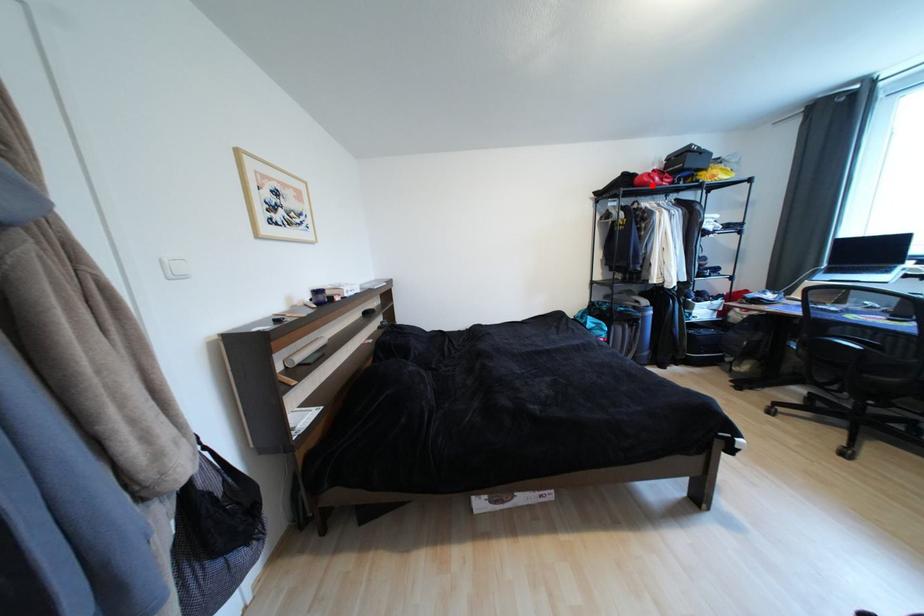
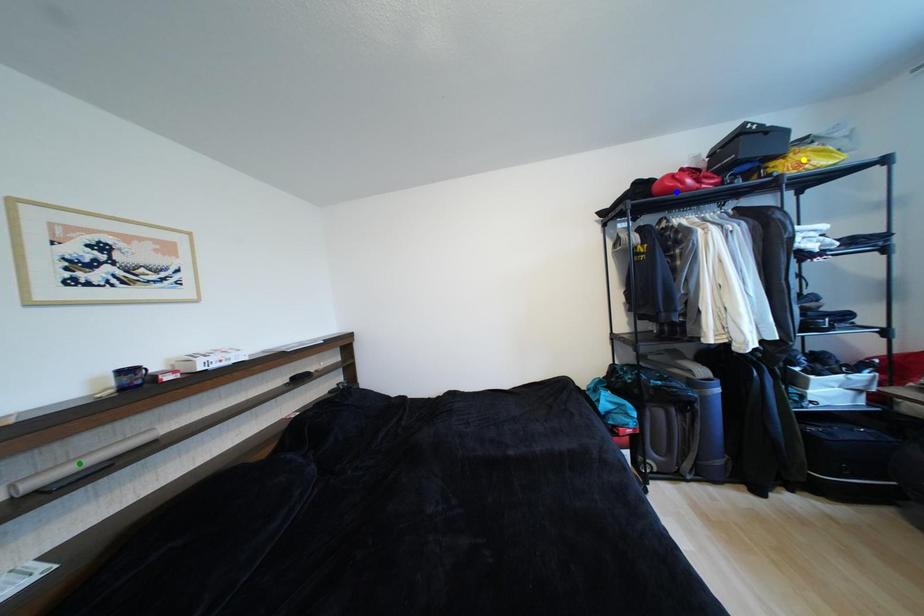
Question: I am providing you with two images of the same scene from different viewpoints. A red point is marked on the first image. You are given multiple points on the second image. In image 2, which mark is for the same physical point as the one in image 1?

Choices:
 (A) blue point
 (B) green point
 (C) yellow point

Answer: (A)